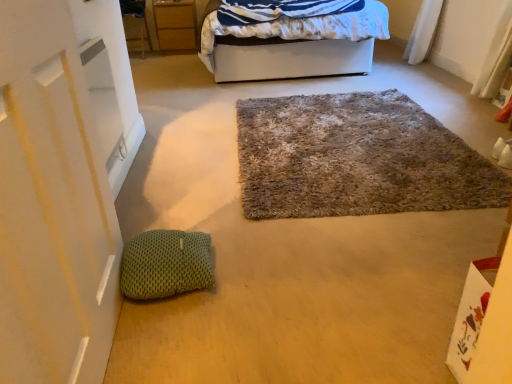
In order to click on free spot behind green knitted pillow at lower left in this screenshot , I will do point(194,224).